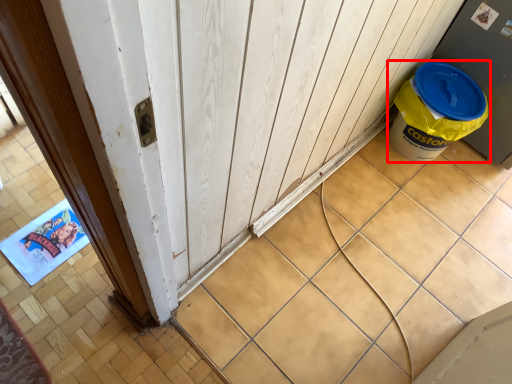
Question: From the image's perspective, where is waste container (annotated by the red box) located in relation to barn door in the image?

Choices:
 (A) below
 (B) above

Answer: (B)